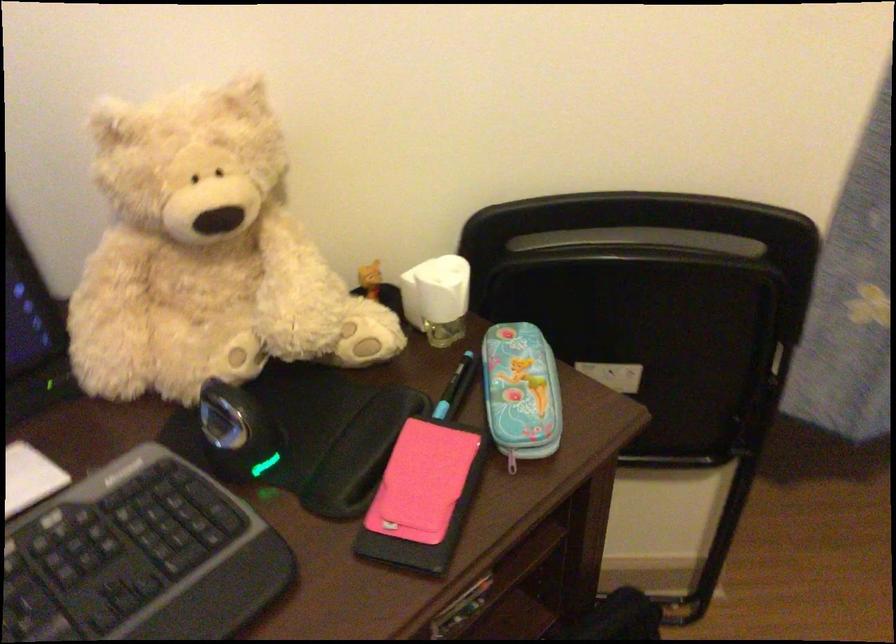
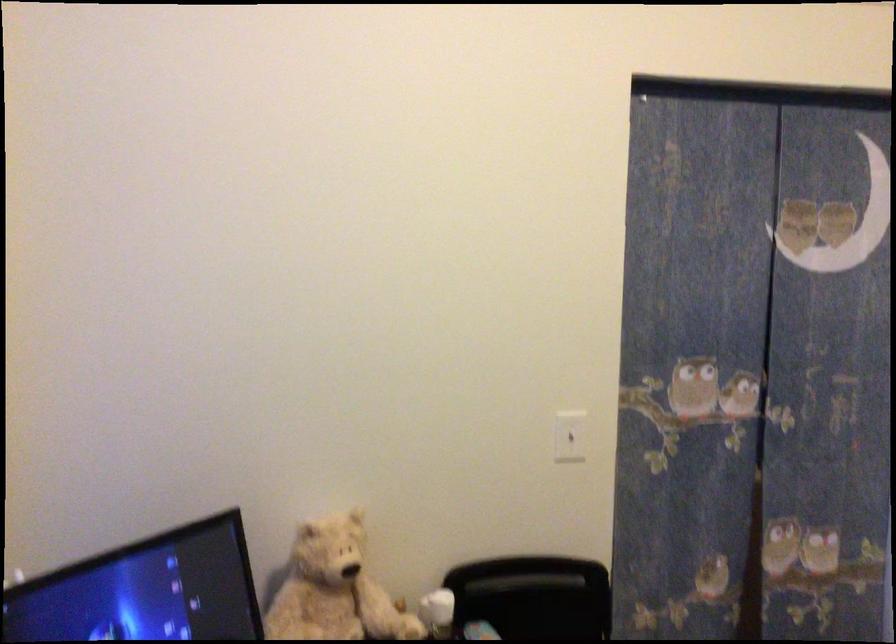
Locate, in the second image, the point that corresponds to (x=228, y=240) in the first image.

(334, 589)